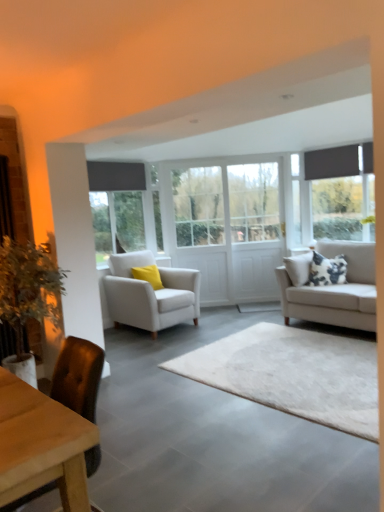
The width and height of the screenshot is (384, 512). What do you see at coordinates (336, 290) in the screenshot?
I see `light gray fabric couch at right` at bounding box center [336, 290].

Describe the element at coordinates (293, 374) in the screenshot. I see `white soft rug at center` at that location.

This screenshot has width=384, height=512. What do you see at coordinates (117, 207) in the screenshot?
I see `matte gray window at center, which ranks as the second window in right-to-left order` at bounding box center [117, 207].

Image resolution: width=384 pixels, height=512 pixels. Identify the location of brown leather chair at lower left, the 2th chair viewed from the back. (78, 376).

Is white fabric armchair at center, the 2th chair from the front, outside of white glass door at center, the first glass door in the right-to-left sequence?

Absolutely, white fabric armchair at center, the 2th chair from the front, is external to white glass door at center, the first glass door in the right-to-left sequence.

Is white fabric armchair at center, which ranks as the first chair in back-to-front order, positioned far away from white glass door at center, the first glass door in the right-to-left sequence?

white fabric armchair at center, which ranks as the first chair in back-to-front order, is far away from white glass door at center, the first glass door in the right-to-left sequence.

Considering the sizes of objects white fabric armchair at center, which ranks as the first chair in back-to-front order, and white glass door at center, the first glass door in the right-to-left sequence, in the image provided, who is thinner, white fabric armchair at center, which ranks as the first chair in back-to-front order, or white glass door at center, the first glass door in the right-to-left sequence,?

With smaller width is white glass door at center, the first glass door in the right-to-left sequence.

Is white fabric armchair at center, the 2th chair from the front, at the back of white soft rug at center?

white soft rug at center does not have its back to white fabric armchair at center, the 2th chair from the front.

How distant is white soft rug at center from white fabric armchair at center, which ranks as the first chair in back-to-front order?

The distance of white soft rug at center from white fabric armchair at center, which ranks as the first chair in back-to-front order, is 4.82 feet.

Which object is positioned more to the left, white soft rug at center or white fabric armchair at center, which ranks as the first chair in back-to-front order?

From the viewer's perspective, white fabric armchair at center, which ranks as the first chair in back-to-front order, appears more on the left side.

Is white soft rug at center far away from white fabric armchair at center, the 2th chair from the front?

Absolutely, white soft rug at center is distant from white fabric armchair at center, the 2th chair from the front.

Consider the image. Is white fabric armchair at center, the 2th chair from the front, bigger than brown leather chair at lower left, the 1th chair when ordered from front to back?

Yes.

Between white fabric armchair at center, which ranks as the first chair in back-to-front order, and brown leather chair at lower left, the 2th chair viewed from the back, which one is positioned in front?

brown leather chair at lower left, the 2th chair viewed from the back, is in front.

Considering the relative sizes of white fabric armchair at center, the 2th chair from the front, and brown leather chair at lower left, the 1th chair when ordered from front to back, in the image provided, is white fabric armchair at center, the 2th chair from the front, wider than brown leather chair at lower left, the 1th chair when ordered from front to back,?

Yes, white fabric armchair at center, the 2th chair from the front, is wider than brown leather chair at lower left, the 1th chair when ordered from front to back.

Is white fabric armchair at center, which ranks as the first chair in back-to-front order, shorter than brown leather chair at lower left, the 2th chair viewed from the back?

In fact, white fabric armchair at center, which ranks as the first chair in back-to-front order, may be taller than brown leather chair at lower left, the 2th chair viewed from the back.

Can you tell me how much white glass door at center, the first glass door in the right-to-left sequence, and brown leather chair at lower left, the 2th chair viewed from the back, differ in facing direction?

The angular difference between white glass door at center, the first glass door in the right-to-left sequence, and brown leather chair at lower left, the 2th chair viewed from the back, is 46.1 degrees.

Is white glass door at center, the second glass door positioned from the left, touching brown leather chair at lower left, the 1th chair when ordered from front to back?

There is a gap between white glass door at center, the second glass door positioned from the left, and brown leather chair at lower left, the 1th chair when ordered from front to back.

Considering the positions of objects white glass door at center, the second glass door positioned from the left, and brown leather chair at lower left, the 1th chair when ordered from front to back, in the image provided, who is more to the left, white glass door at center, the second glass door positioned from the left, or brown leather chair at lower left, the 1th chair when ordered from front to back,?

brown leather chair at lower left, the 1th chair when ordered from front to back.

Is light gray fabric couch at right not inside white fabric armchair at center, which ranks as the first chair in back-to-front order?

Indeed, light gray fabric couch at right is completely outside white fabric armchair at center, which ranks as the first chair in back-to-front order.

From the picture: Considering the sizes of objects light gray fabric couch at right and white fabric armchair at center, which ranks as the first chair in back-to-front order, in the image provided, who is bigger, light gray fabric couch at right or white fabric armchair at center, which ranks as the first chair in back-to-front order,?

light gray fabric couch at right is bigger.

Who is more distant, light gray fabric couch at right or white fabric armchair at center, the 2th chair from the front?

white fabric armchair at center, the 2th chair from the front, is further away from the camera.

Image resolution: width=384 pixels, height=512 pixels. In order to click on glass door that is the 2nd one above the white soft rug at center (from a real-world perspective) in this screenshot , I will do `click(254, 230)`.

Looking at this image, are white glass door at center, the first glass door in the right-to-left sequence, and white soft rug at center far apart?

Yes, white glass door at center, the first glass door in the right-to-left sequence, and white soft rug at center are located far from each other.

From the image's perspective, relative to white soft rug at center, is white glass door at center, the first glass door in the right-to-left sequence, above or below?

Based on their image positions, white glass door at center, the first glass door in the right-to-left sequence, is located above white soft rug at center.

Which is more to the left, white glass door at center, the first glass door in the right-to-left sequence, or white soft rug at center?

white soft rug at center is more to the left.

Is clear glass door at center, placed as the second glass door when sorted from right to left, located outside white fabric armchair at center, the 2th chair from the front?

Yes, clear glass door at center, placed as the second glass door when sorted from right to left, is located beyond the bounds of white fabric armchair at center, the 2th chair from the front.

Based on their positions, is clear glass door at center, placed as the second glass door when sorted from right to left, located to the left or right of white fabric armchair at center, which ranks as the first chair in back-to-front order?

clear glass door at center, placed as the second glass door when sorted from right to left, is positioned on white fabric armchair at center, which ranks as the first chair in back-to-front order,'s right side.

Who is bigger, clear glass door at center, placed as the second glass door when sorted from right to left, or white fabric armchair at center, the 2th chair from the front?

Bigger between the two is white fabric armchair at center, the 2th chair from the front.

Find the location of a particular element. The width and height of the screenshot is (384, 512). glass door that is the 1st one when counting backward from the white fabric armchair at center, the 2th chair from the front is located at coordinates (254, 230).

This screenshot has height=512, width=384. Find the location of `plain on the right of white fabric armchair at center, the 2th chair from the front`. plain on the right of white fabric armchair at center, the 2th chair from the front is located at coordinates 293,374.

Which object lies further to the anchor point white soft rug at center, white glass door at center, the first glass door in the right-to-left sequence, or light gray fabric couch at right?

Answer: The object further to white soft rug at center is white glass door at center, the first glass door in the right-to-left sequence.

Looking at the image, which one is located further to white glass door at center, the second glass door positioned from the left, white wooden door at center, acting as the 2th window starting from the left, or brown leather chair at lower left, the 2th chair viewed from the back?

Among the two, brown leather chair at lower left, the 2th chair viewed from the back, is located further to white glass door at center, the second glass door positioned from the left.

When comparing their distances from white fabric armchair at center, the 2th chair from the front, does white wooden door at center, acting as the 2th window starting from the left, or matte gray window at center, which ranks as the second window in right-to-left order, seem further?

white wooden door at center, acting as the 2th window starting from the left, is further to white fabric armchair at center, the 2th chair from the front.

Based on their spatial positions, is matte gray window at center, the 1th window when ordered from left to right, or white soft rug at center further from white fabric armchair at center, which ranks as the first chair in back-to-front order?

matte gray window at center, the 1th window when ordered from left to right, is further to white fabric armchair at center, which ranks as the first chair in back-to-front order.

Which object lies further to the anchor point brown leather chair at lower left, the 1th chair when ordered from front to back, clear glass door at center, which is the first glass door from left to right, or white fabric armchair at center, which ranks as the first chair in back-to-front order?

The object further to brown leather chair at lower left, the 1th chair when ordered from front to back, is clear glass door at center, which is the first glass door from left to right.

Based on their spatial positions, is light gray fabric couch at right or clear glass door at center, which is the first glass door from left to right, further from brown leather chair at lower left, the 2th chair viewed from the back?

clear glass door at center, which is the first glass door from left to right, is positioned further to the anchor brown leather chair at lower left, the 2th chair viewed from the back.

Estimate the real-world distances between objects in this image. Which object is closer to light gray fabric couch at right, clear glass door at center, which is the first glass door from left to right, or white soft rug at center?

white soft rug at center lies closer to light gray fabric couch at right than the other object.

Considering their positions, is clear glass door at center, placed as the second glass door when sorted from right to left, positioned closer to white soft rug at center than white wooden door at center, acting as the 2th window starting from the left?

Based on the image, clear glass door at center, placed as the second glass door when sorted from right to left, appears to be nearer to white soft rug at center.

Identify the location of glass door between white soft rug at center and clear glass door at center, which is the first glass door from left to right, in the front-back direction. The width and height of the screenshot is (384, 512). (254, 230).

I want to click on plain located between brown leather chair at lower left, the 1th chair when ordered from front to back, and white glass door at center, the first glass door in the right-to-left sequence, in the depth direction, so click(x=293, y=374).

Locate an element on the screen. The width and height of the screenshot is (384, 512). chair between white soft rug at center and clear glass door at center, which is the first glass door from left to right, along the z-axis is located at coordinates (150, 294).

The height and width of the screenshot is (512, 384). In order to click on studio couch between brown leather chair at lower left, the 1th chair when ordered from front to back, and matte gray window at center, which ranks as the second window in right-to-left order, along the z-axis in this screenshot , I will do `click(336, 290)`.